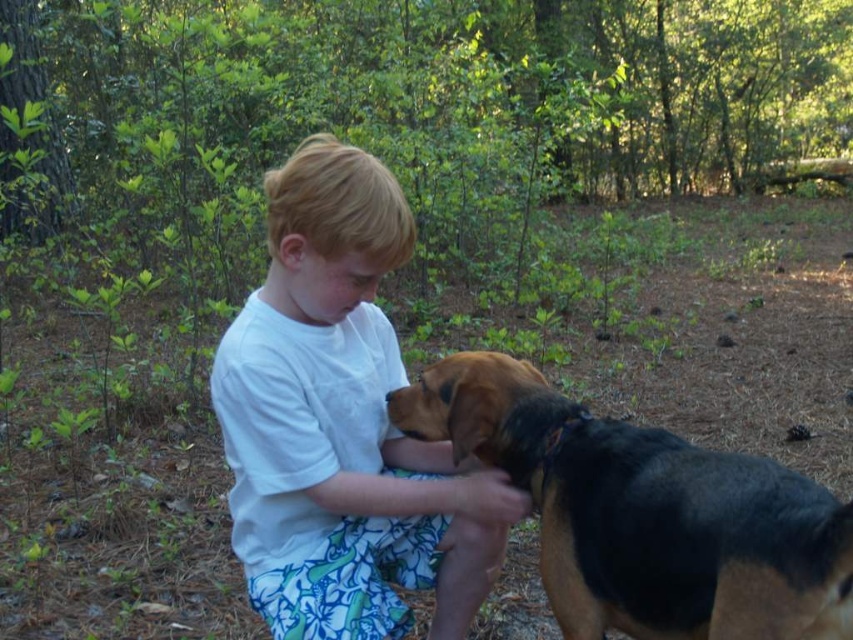
Question: Does white cotton shirt at center have a lesser width compared to black and tan fur at center?

Choices:
 (A) yes
 (B) no

Answer: (A)

Question: Among these points, which one is farthest from the camera?

Choices:
 (A) click(x=444, y=410)
 (B) click(x=407, y=454)

Answer: (B)

Question: Is white cotton shirt at center in front of black and tan fur at center?

Choices:
 (A) no
 (B) yes

Answer: (A)

Question: From the image, what is the correct spatial relationship of white cotton shirt at center in relation to black and tan fur at center?

Choices:
 (A) below
 (B) above

Answer: (B)